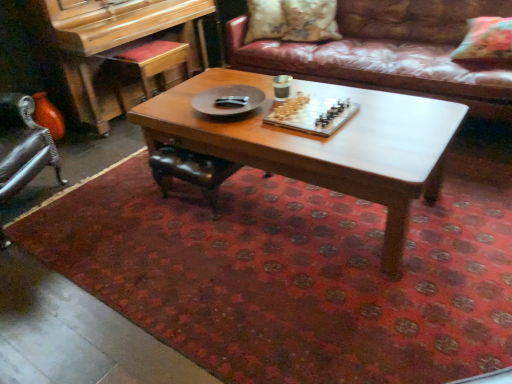
Where is `free space in front of translucent glass chessboard at center`? free space in front of translucent glass chessboard at center is located at coordinates (338, 147).